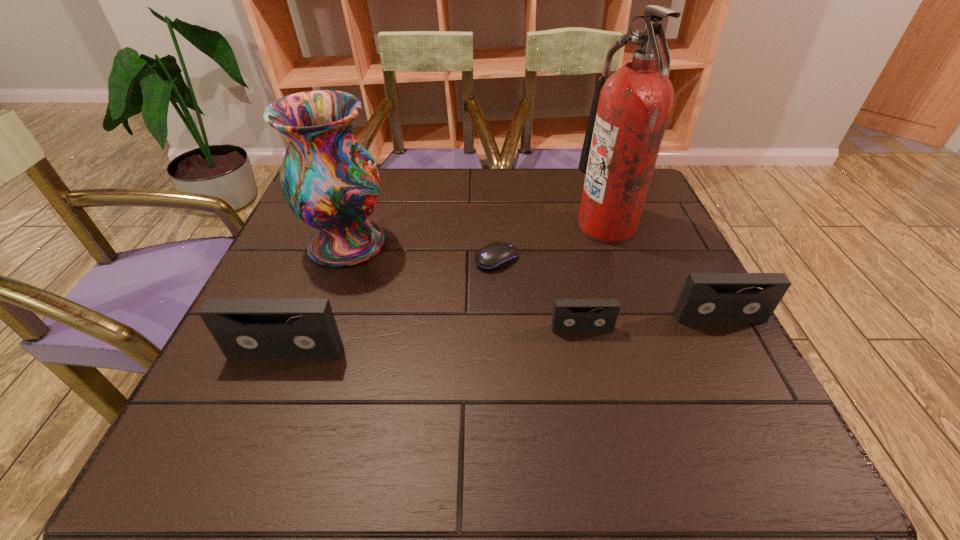
Please point a space for a new videotape to maintain equal intervals. Please provide its 2D coordinates. Your answer should be formatted as a tuple, i.e. [(x, y)], where the tuple contains the x and y coordinates of a point satisfying the conditions above.

[(438, 340)]